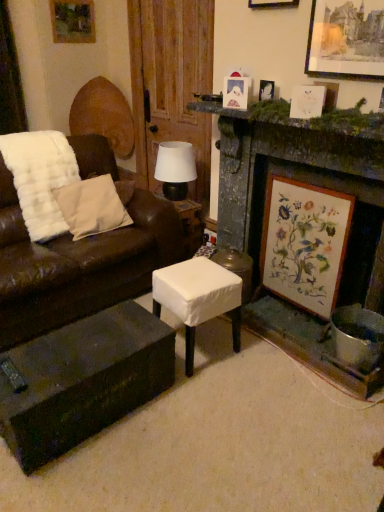
Question: Is white paper picture frame at upper right, which appears as the second picture frame when ordered from the bottom, not inside beige cotton pillow at left?

Choices:
 (A) no
 (B) yes

Answer: (B)

Question: Is the position of white paper picture frame at upper right, which is counted as the fifth picture frame, starting from the back, less distant than that of beige cotton pillow at left?

Choices:
 (A) yes
 (B) no

Answer: (A)

Question: Does white paper picture frame at upper right, the third picture frame from the right, have a larger size compared to beige cotton pillow at left?

Choices:
 (A) yes
 (B) no

Answer: (B)

Question: Is white paper picture frame at upper right, which is counted as the fifth picture frame, starting from the top, directly adjacent to beige cotton pillow at left?

Choices:
 (A) no
 (B) yes

Answer: (A)

Question: Would you consider white paper picture frame at upper right, the third picture frame from the right, to be distant from beige cotton pillow at left?

Choices:
 (A) yes
 (B) no

Answer: (A)

Question: From a real-world perspective, is white paper picture frame at upper right, which appears as the second picture frame when ordered from the bottom, beneath beige cotton pillow at left?

Choices:
 (A) yes
 (B) no

Answer: (B)

Question: Is dark wood coffee table at lower center located within matte black table lamp at center?

Choices:
 (A) yes
 (B) no

Answer: (B)

Question: Does matte black table lamp at center have a greater height compared to dark wood coffee table at lower center?

Choices:
 (A) no
 (B) yes

Answer: (B)

Question: Can you confirm if matte black table lamp at center is wider than dark wood coffee table at lower center?

Choices:
 (A) no
 (B) yes

Answer: (A)

Question: Does matte black table lamp at center have a smaller size compared to dark wood coffee table at lower center?

Choices:
 (A) yes
 (B) no

Answer: (A)

Question: From the image's perspective, is matte black table lamp at center below dark wood coffee table at lower center?

Choices:
 (A) yes
 (B) no

Answer: (B)

Question: Is matte black table lamp at center closer to the viewer compared to dark wood coffee table at lower center?

Choices:
 (A) yes
 (B) no

Answer: (B)

Question: Does wooden picture frame at upper left, placed as the 1th picture frame when sorted from top to bottom, lie behind beige cotton pillow at left?

Choices:
 (A) no
 (B) yes

Answer: (B)